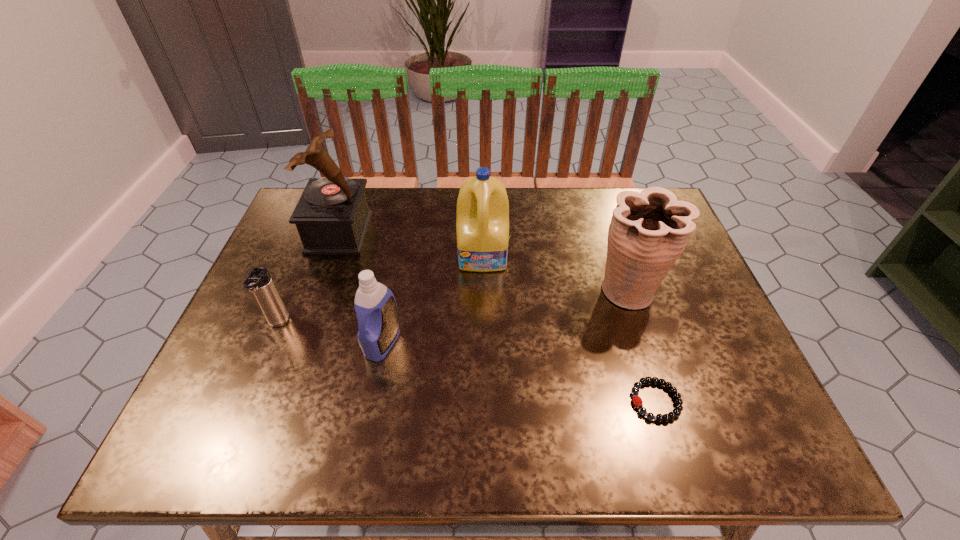
At what (x,y) coordinates should I click in order to perform the action: click on vacant point that satisfies the following two spatial constraints: 1. at the horn opening of the third object from left to right; 2. on the right side of the phonograph_record. Please return your answer as a coordinate pair (x, y). Looking at the image, I should click on (300, 343).

Where is `free location that satisfies the following two spatial constraints: 1. on the front side of the nearest object; 2. on the left side of the third object from left to right`? free location that satisfies the following two spatial constraints: 1. on the front side of the nearest object; 2. on the left side of the third object from left to right is located at coordinates (372, 401).

Where is `free location that satisfies the following two spatial constraints: 1. on the handle side of the nearest object; 2. on the left side of the fifth tallest object`? The width and height of the screenshot is (960, 540). free location that satisfies the following two spatial constraints: 1. on the handle side of the nearest object; 2. on the left side of the fifth tallest object is located at coordinates (x=246, y=401).

Image resolution: width=960 pixels, height=540 pixels. I want to click on vacant space that satisfies the following two spatial constraints: 1. at the horn opening of the phonograph_record; 2. on the handle side of the thermos bottle, so click(307, 324).

Identify the location of vacant position in the image that satisfies the following two spatial constraints: 1. on the label of the farther detergent; 2. on the left side of the urn. The image size is (960, 540). (484, 290).

This screenshot has width=960, height=540. I want to click on free space that satisfies the following two spatial constraints: 1. on the back side of the shorter detergent; 2. at the horn opening of the phonograph_record, so click(x=404, y=232).

At what (x,y) coordinates should I click in order to perform the action: click on free space in the image that satisfies the following two spatial constraints: 1. at the horn opening of the tallest object; 2. on the left side of the bracelet. Please return your answer as a coordinate pair (x, y). Looking at the image, I should click on (279, 401).

Where is `free space that satisfies the following two spatial constraints: 1. on the handle side of the fifth tallest object; 2. on the right side of the nearest object`? This screenshot has height=540, width=960. free space that satisfies the following two spatial constraints: 1. on the handle side of the fifth tallest object; 2. on the right side of the nearest object is located at coordinates (246, 401).